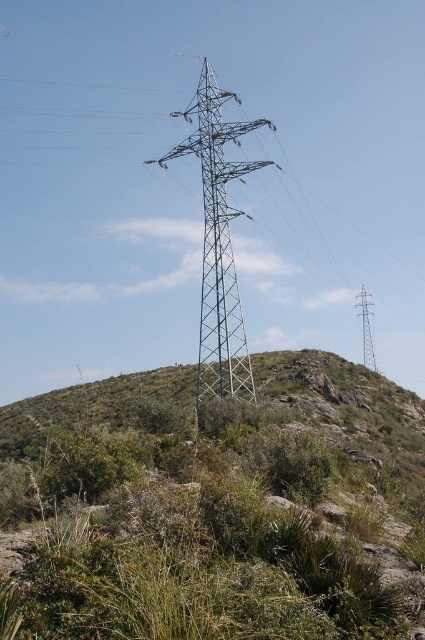
You are standing at the base of the hill in the image. You see the point marked as point (218, 241). What object does this point represent?

The point (218, 241) represents the metallic grid tower at center.

You are a drone operator planning to fly a drone over the landscape shown in the image. The drone must avoid any obstacles located at specific coordinates. According to the provided information, what are the coordinates of the green grassy shrubs at center that the drone should avoid?

The green grassy shrubs at center are located at coordinates point (204, 545), so the drone should avoid this area.

You are standing at the base of the hill near the electrical pylon. You need to place a small weather station on the green grassy shrubs at center. According to the coordinates provided, where exactly should you position the weather station?

The green grassy shrubs at center are located at point (204, 545), so you should position the weather station there.